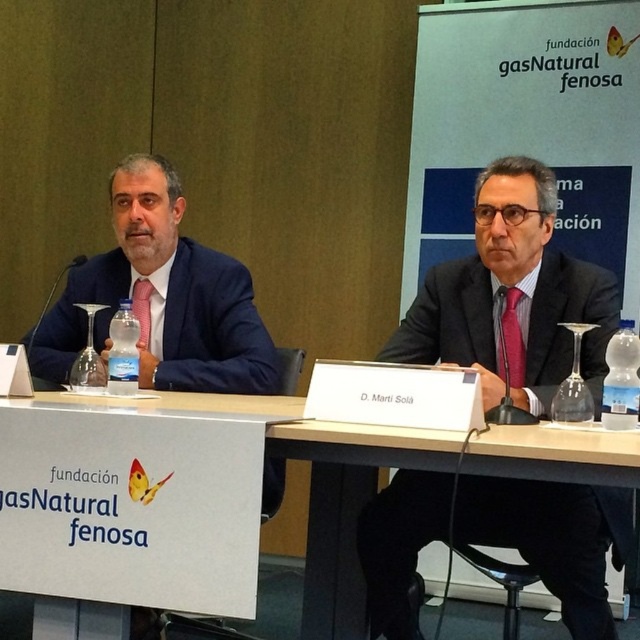
Which is below, dark blue suit at center or matte black suit at left?

dark blue suit at center is lower down.

Can you confirm if dark blue suit at center is positioned to the left of matte black suit at left?

Answer: Incorrect, dark blue suit at center is not on the left side of matte black suit at left.

Where is `dark blue suit at center`? dark blue suit at center is located at coordinates (554, 538).

Is matte black suit at left to the right of brown wooden table at center from the viewer's perspective?

Incorrect, matte black suit at left is not on the right side of brown wooden table at center.

In order to click on matte black suit at left in this screenshot , I will do `click(161, 298)`.

Does white plastic table at center have a larger size compared to matte black suit at left?

Incorrect, white plastic table at center is not larger than matte black suit at left.

Between point (204, 608) and point (164, 208), which one is positioned in front?

Point (204, 608) is in front.

What do you see at coordinates (140, 508) in the screenshot? This screenshot has width=640, height=640. I see `white plastic table at center` at bounding box center [140, 508].

Locate an element on the screen. This screenshot has width=640, height=640. white plastic table at center is located at coordinates (140, 508).